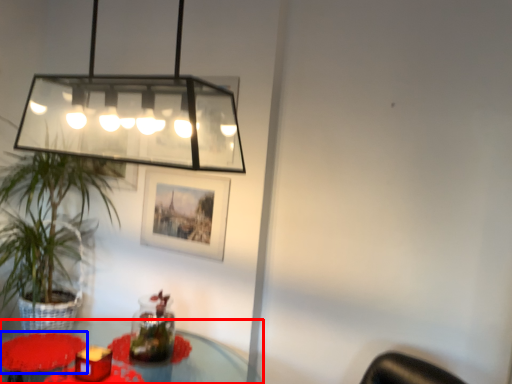
Question: Which object is closer to the camera taking this photo, table (highlighted by a red box) or flower (highlighted by a blue box)?

Choices:
 (A) table
 (B) flower

Answer: (A)